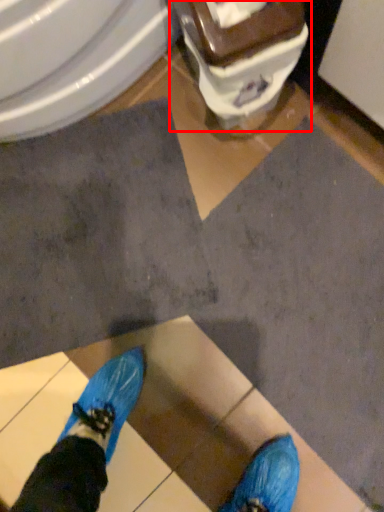
Question: From the image's perspective, where is toilet (annotated by the red box) located relative to bidet?

Choices:
 (A) below
 (B) above

Answer: (A)